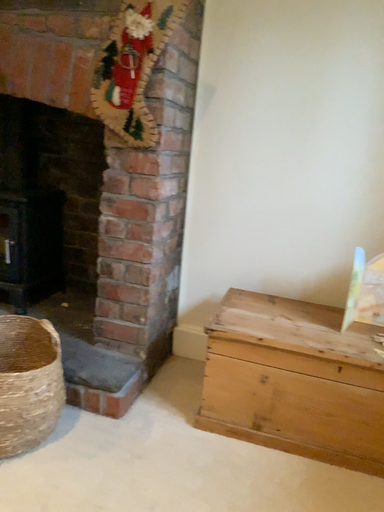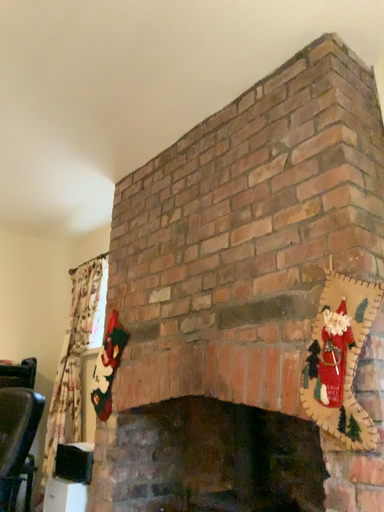
Question: How did the camera likely rotate when shooting the video?

Choices:
 (A) rotated right
 (B) rotated left

Answer: (B)